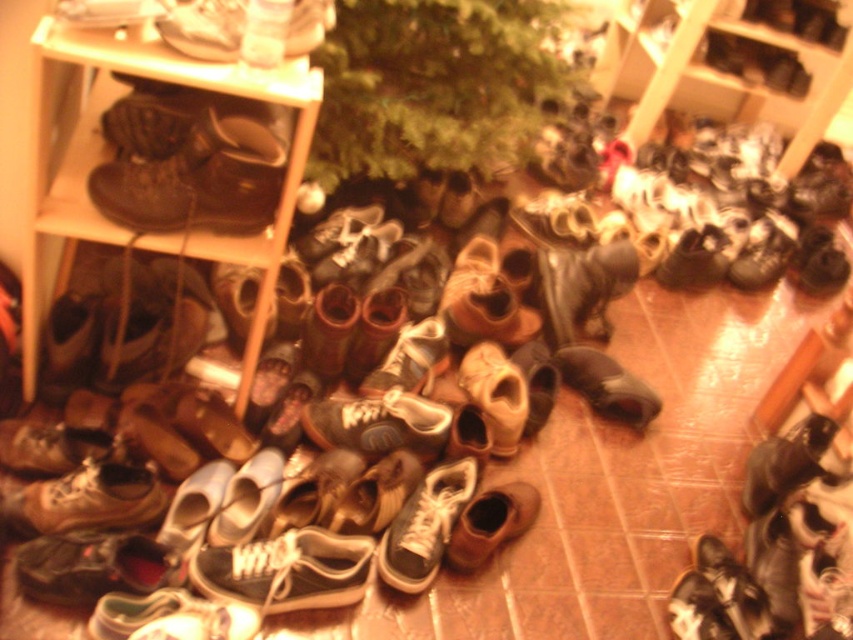
In the scene shown: You are organizing the shoes in the cluttered indoor space. You need to place a new shoe between the brown leather sneaker at lower left and the shiny brown shoe at center. Is there enough vertical space between them to fit the new shoe?

The brown leather sneaker at lower left is below the shiny brown shoe at center, so there is vertical space between them to fit a new shoe.

You are a delivery person who needs to place a small package between the brown leather boots at left and the matte white shoe at upper left. Can you fit the package if it measures 10 inches in length?

The distance between the brown leather boots at left and the matte white shoe at upper left is 9.03 inches. Since the package is 10 inches long, it cannot fit in the space between them.

You are standing in the cluttered indoor space with shoes everywhere. You see two points marked in the image. Which point is closer to you, point (160, 484) or point (635, 387)?

Point (160, 484) is closer to you because it is in front of point (635, 387).